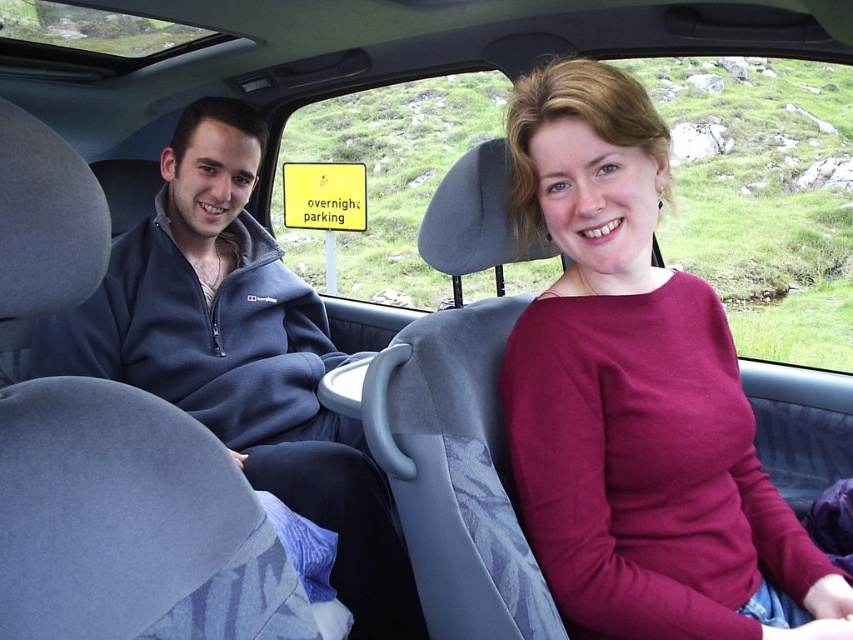
Question: Does maroon sweater at center come in front of dark blue fleece at left?

Choices:
 (A) yes
 (B) no

Answer: (A)

Question: Is maroon sweater at center thinner than dark blue fleece at left?

Choices:
 (A) yes
 (B) no

Answer: (A)

Question: Considering the relative positions of maroon sweater at center and dark blue fleece at left in the image provided, where is maroon sweater at center located with respect to dark blue fleece at left?

Choices:
 (A) above
 (B) below

Answer: (A)

Question: Which point is closer to the camera?

Choices:
 (A) (192, 340)
 (B) (579, 234)

Answer: (B)